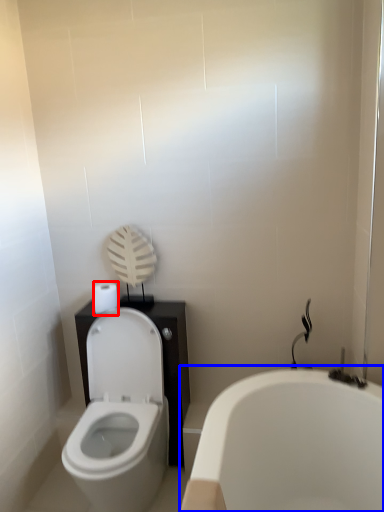
Question: Which object is closer to the camera taking this photo, toilet paper (highlighted by a red box) or bathtub (highlighted by a blue box)?

Choices:
 (A) toilet paper
 (B) bathtub

Answer: (B)